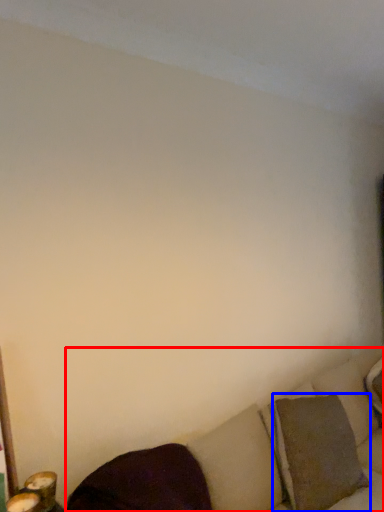
Question: Which point is closer to the camera, studio couch (highlighted by a red box) or pillow (highlighted by a blue box)?

Choices:
 (A) studio couch
 (B) pillow

Answer: (A)